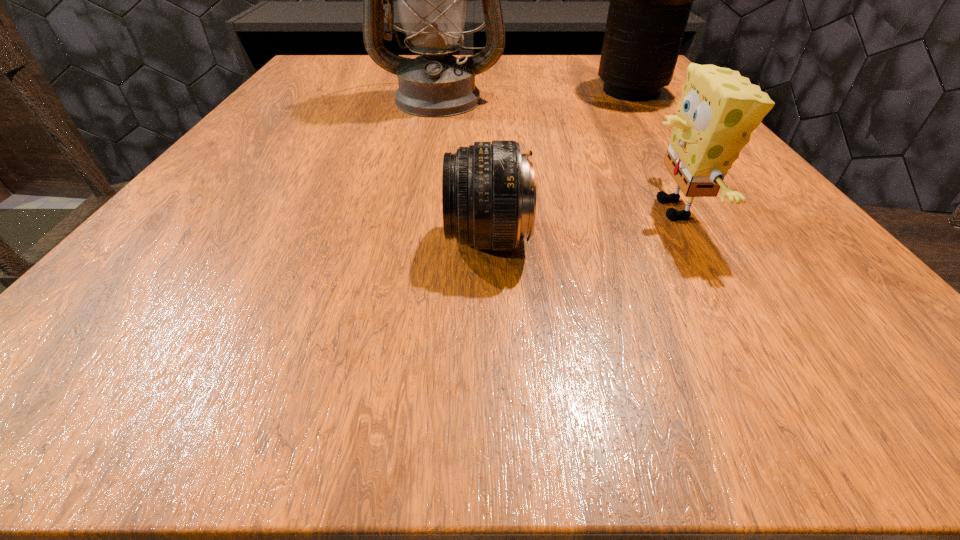
What are the coordinates of `vacant space at the near edge` in the screenshot? It's located at (646, 374).

Locate an element on the screen. This screenshot has width=960, height=540. vacant space at the left edge of the desktop is located at coordinates (283, 221).

Find the location of a particular element. The height and width of the screenshot is (540, 960). vacant region at the right edge is located at coordinates (701, 218).

Locate an element on the screen. vacant space at the far left corner of the desktop is located at coordinates (314, 63).

This screenshot has width=960, height=540. Find the location of `vacant space at the far right corner`. vacant space at the far right corner is located at coordinates (593, 82).

Find the location of `free space between the oil lamp and the taller telephoto lens`. free space between the oil lamp and the taller telephoto lens is located at coordinates (535, 95).

This screenshot has height=540, width=960. I want to click on empty space between the oil lamp and the second shortest object, so click(557, 154).

At what (x,y) coordinates should I click in order to perform the action: click on vacant space that's between the sponge and the taller telephoto lens. Please return your answer as a coordinate pair (x, y). The image size is (960, 540). Looking at the image, I should click on (653, 151).

Image resolution: width=960 pixels, height=540 pixels. Identify the location of free spot between the farther telephoto lens and the tallest object. (535, 95).

This screenshot has height=540, width=960. In order to click on free spot between the sponge and the left telephoto lens in this screenshot , I will do `click(581, 225)`.